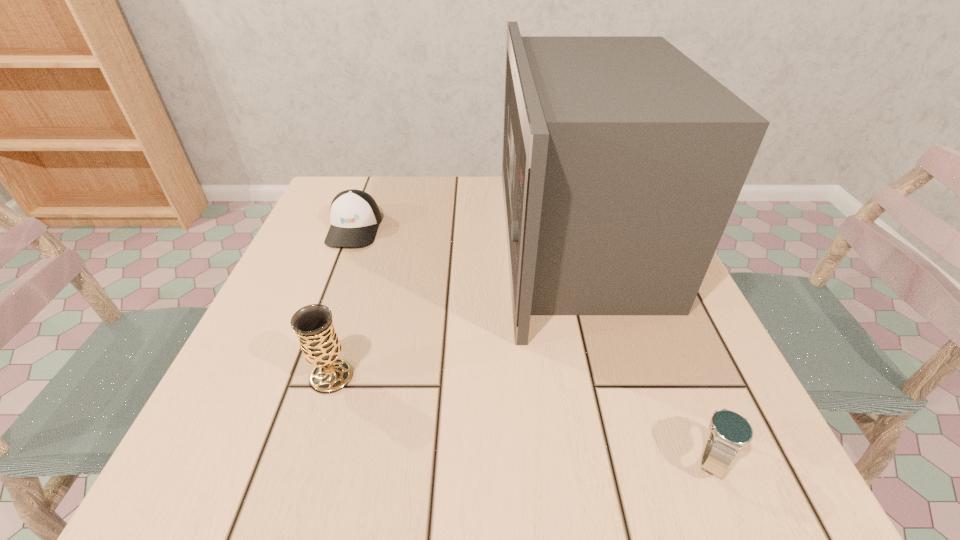
The image size is (960, 540). What are the coordinates of `vacant area that satisfies the following two spatial constraints: 1. on the front panel of the cap; 2. on the left side of the third shortest object` in the screenshot? It's located at (299, 376).

Find the location of `vacant space that satisfies the following two spatial constraints: 1. on the front side of the watch; 2. on the left side of the second nearest object`. vacant space that satisfies the following two spatial constraints: 1. on the front side of the watch; 2. on the left side of the second nearest object is located at coordinates (306, 457).

Where is `free location that satisfies the following two spatial constraints: 1. on the front-facing side of the watch; 2. on the left side of the microwave oven`? The width and height of the screenshot is (960, 540). free location that satisfies the following two spatial constraints: 1. on the front-facing side of the watch; 2. on the left side of the microwave oven is located at coordinates (637, 457).

Locate an element on the screen. vacant point that satisfies the following two spatial constraints: 1. on the front-facing side of the microwave oven; 2. on the right side of the watch is located at coordinates (637, 457).

This screenshot has height=540, width=960. I want to click on free space in the image that satisfies the following two spatial constraints: 1. on the front-facing side of the watch; 2. on the left side of the tallest object, so click(x=637, y=457).

Locate an element on the screen. The height and width of the screenshot is (540, 960). free space that satisfies the following two spatial constraints: 1. on the front-facing side of the tallest object; 2. on the left side of the nearest object is located at coordinates (637, 457).